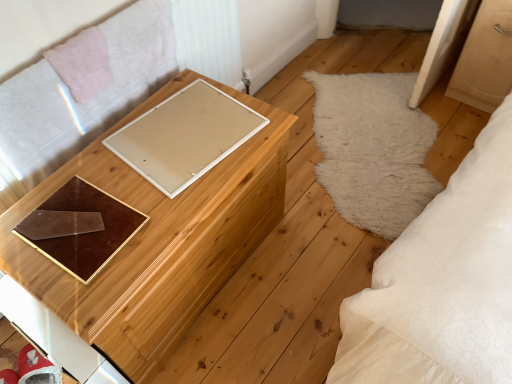
What do you see at coordinates (185, 136) in the screenshot? I see `beige matte board at center` at bounding box center [185, 136].

Locate an element on the screen. The image size is (512, 384). brown glossy tray at center is located at coordinates click(x=81, y=228).

Locate an element on the screen. The image size is (512, 384). beige matte board at center is located at coordinates (185, 136).

What's the angular difference between beige matte board at center and wooden chest at center's facing directions?

They differ by 7.94 degrees in their facing directions.

Is point (164, 193) closer to camera compared to point (246, 223)?

Yes, it is.

Is beige matte board at center closer to camera compared to wooden chest at center?

No, the depth of beige matte board at center is greater than that of wooden chest at center.

From the picture: Does beige matte board at center turn towards wooden chest at center?

Yes.

From a real-world perspective, does brown glossy tray at center sit lower than wooden chest at center?

No, from a real-world perspective, brown glossy tray at center is not below wooden chest at center.

Between brown glossy tray at center and wooden chest at center, which one has larger width?

wooden chest at center.

Is brown glossy tray at center taller than wooden chest at center?

No.

How distant is brown glossy tray at center from wooden chest at center?

brown glossy tray at center and wooden chest at center are 8.79 inches apart.

Would you say brown glossy tray at center is part of beige matte board at center's contents?

Actually, brown glossy tray at center is outside beige matte board at center.

Is beige matte board at center to the right of brown glossy tray at center from the viewer's perspective?

Yes, beige matte board at center is to the right of brown glossy tray at center.

Is beige matte board at center bigger or smaller than brown glossy tray at center?

Clearly, beige matte board at center is larger in size than brown glossy tray at center.

Locate an element on the screen. This screenshot has height=384, width=512. pad that is on the right side of brown glossy tray at center is located at coordinates (185, 136).

Is wooden chest at center further to camera compared to beige matte board at center?

No, wooden chest at center is closer to the viewer.

Is wooden chest at center far away from beige matte board at center?

That's not correct — wooden chest at center is a little close to beige matte board at center.

How many degrees apart are the facing directions of wooden chest at center and beige matte board at center?

The angle between the facing direction of wooden chest at center and the facing direction of beige matte board at center is 7.94 degrees.

Considering the sizes of objects wooden chest at center and beige matte board at center in the image provided, who is shorter, wooden chest at center or beige matte board at center?

beige matte board at center is shorter.

From the image's perspective, who appears lower, brown glossy tray at center or beige matte board at center?

brown glossy tray at center.

Which object is thinner, brown glossy tray at center or beige matte board at center?

brown glossy tray at center is thinner.

How far apart are brown glossy tray at center and beige matte board at center?

9.81 inches.

I want to click on pad that appears below the brown glossy tray at center (from a real-world perspective), so click(185, 136).

Identify the location of furniture directly beneath the brown glossy tray at center (from a real-world perspective). The height and width of the screenshot is (384, 512). (158, 240).

From a real-world perspective, is wooden chest at center positioned above or below brown glossy tray at center?

A: Clearly, from a real-world perspective, wooden chest at center is below brown glossy tray at center.

Is wooden chest at center aimed at brown glossy tray at center?

No.

Relative to brown glossy tray at center, is wooden chest at center in front or behind?

Visually, wooden chest at center is located in front of brown glossy tray at center.

This screenshot has width=512, height=384. In order to click on pad lying behind the wooden chest at center in this screenshot , I will do `click(185, 136)`.

Identify the location of tray above the wooden chest at center (from a real-world perspective). (81, 228).

Considering their positions, is brown glossy tray at center positioned further to beige matte board at center than wooden chest at center?

brown glossy tray at center is further to beige matte board at center.

Looking at the image, which one is located closer to wooden chest at center, brown glossy tray at center or beige matte board at center?

Based on the image, beige matte board at center appears to be nearer to wooden chest at center.

Based on their spatial positions, is wooden chest at center or beige matte board at center further from brown glossy tray at center?

beige matte board at center.

Based on their spatial positions, is beige matte board at center or wooden chest at center further from brown glossy tray at center?

The object further to brown glossy tray at center is beige matte board at center.

Based on their spatial positions, is beige matte board at center or brown glossy tray at center closer to wooden chest at center?

Among the two, beige matte board at center is located nearer to wooden chest at center.

Estimate the real-world distances between objects in this image. Which object is closer to beige matte board at center, wooden chest at center or brown glossy tray at center?

wooden chest at center is closer to beige matte board at center.

Identify the location of tray between beige matte board at center and wooden chest at center from top to bottom. (81, 228).